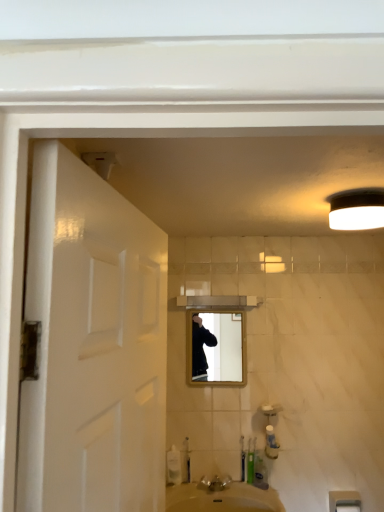
Question: In terms of width, does white plastic towel bar at lower right look wider or thinner when compared to white matte light fixture at upper right?

Choices:
 (A) thin
 (B) wide

Answer: (A)

Question: Would you say white plastic towel bar at lower right is to the left or to the right of white matte light fixture at upper right in the picture?

Choices:
 (A) right
 (B) left

Answer: (A)

Question: Estimate the real-world distances between objects in this image. Which object is closer to the green plastic toothbrush at lower center?

Choices:
 (A) white matte door at left
 (B) silver metallic faucet at lower center
 (C) matte wooden mirror at center
 (D) white plastic soap dispenser at lower center
 (E) white matte light fixture at upper right

Answer: (B)

Question: Which object is positioned farthest from the matte wooden mirror at center?

Choices:
 (A) white plastic towel bar at lower right
 (B) green plastic toothbrush at lower center
 (C) white matte light fixture at upper right
 (D) white matte door at left
 (E) silver metallic faucet at lower center

Answer: (D)